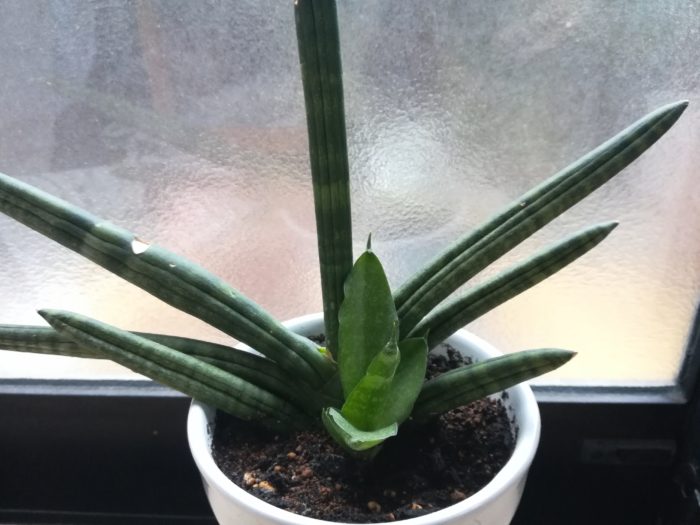
Identify the location of windows sill. This screenshot has height=525, width=700. (621, 503).